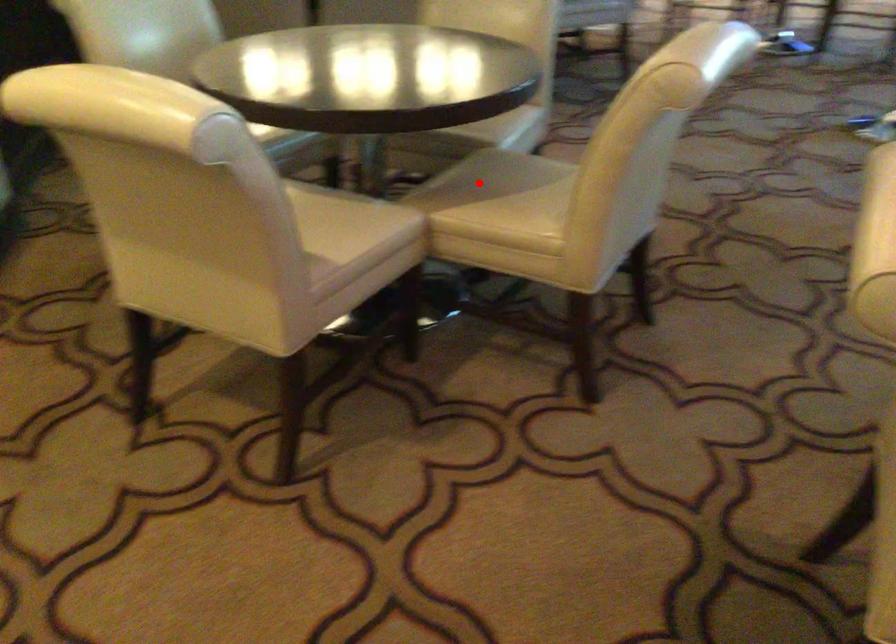
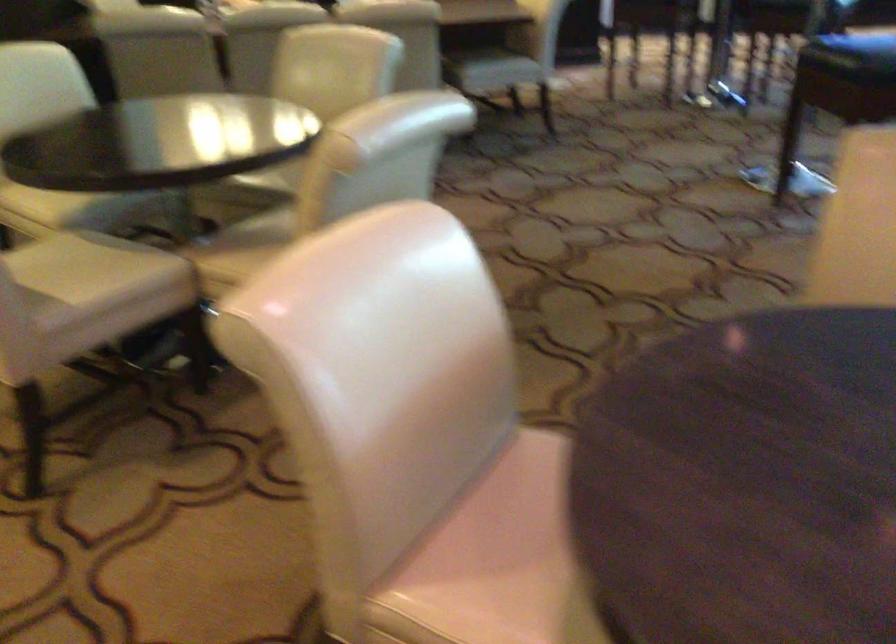
Question: I am providing you with two images of the same scene from different viewpoints. In image1, a red point is highlighted. Considering the same 3D point in image2, which of the following is correct?

Choices:
 (A) It is closer
 (B) It is farther

Answer: (B)